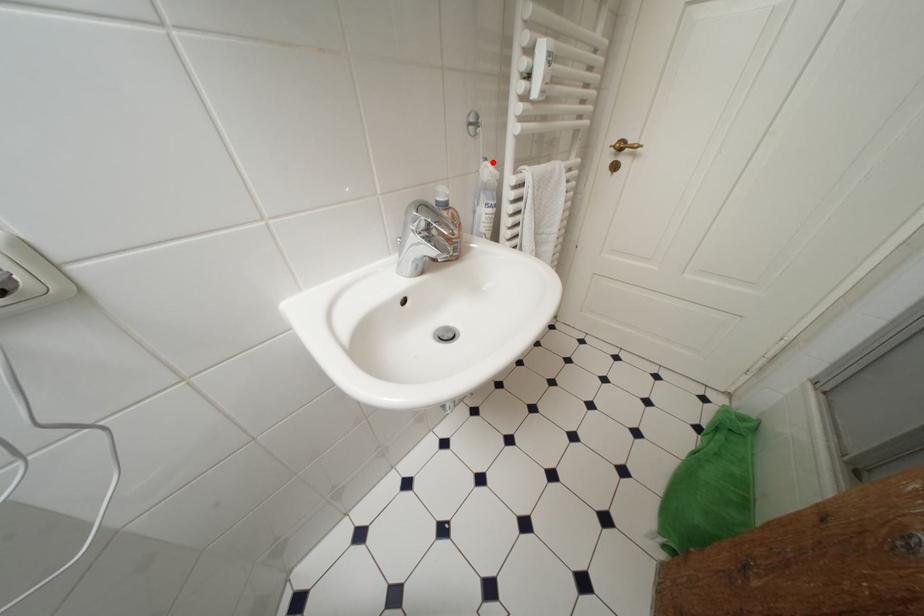
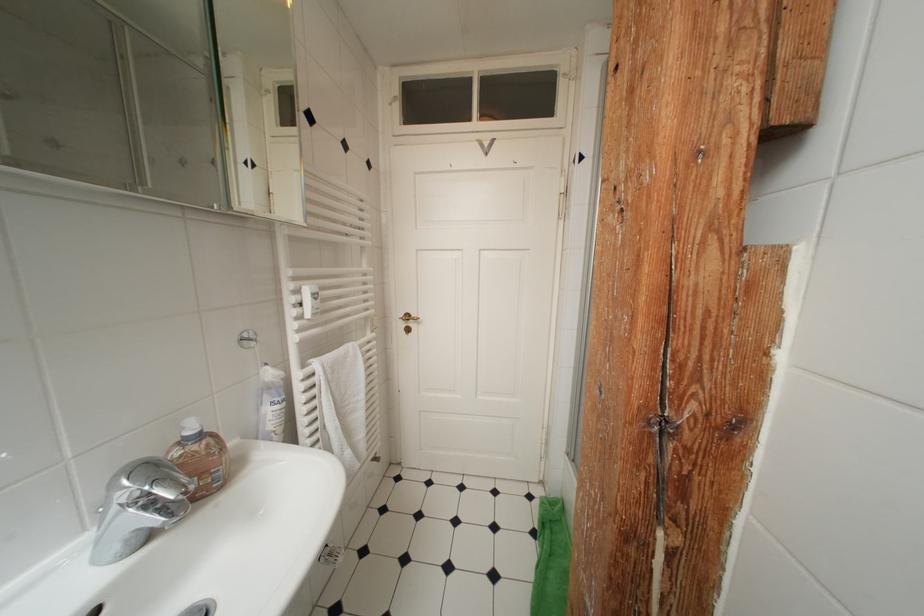
In the second image, find the point that corresponds to the highlighted location in the first image.

(274, 368)